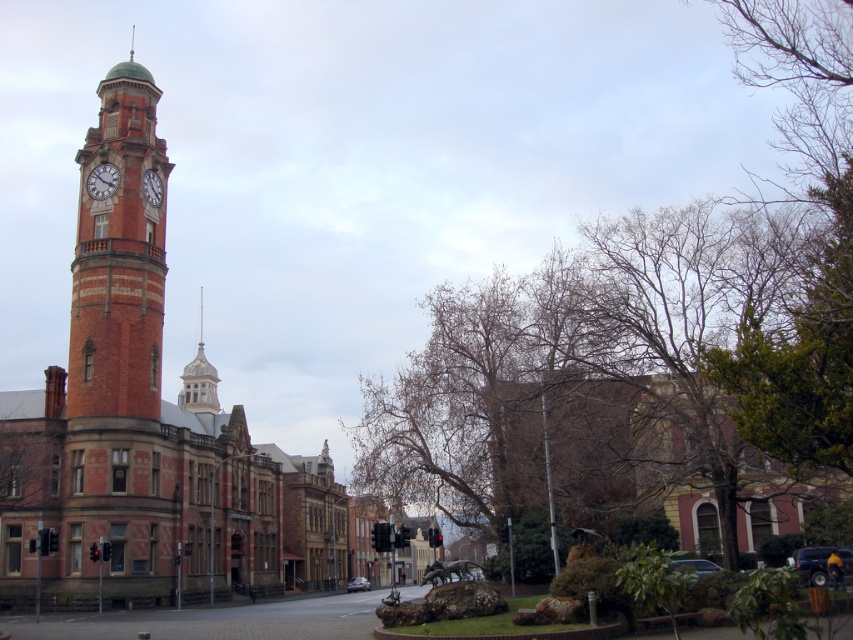
Based on the photo, how far apart are brick clock tower at left and matte brick clock tower at left?

brick clock tower at left and matte brick clock tower at left are 30.52 feet apart from each other.

Can you confirm if brick clock tower at left is thinner than matte brick clock tower at left?

No.

This screenshot has width=853, height=640. What do you see at coordinates (119, 259) in the screenshot?
I see `brick clock tower at left` at bounding box center [119, 259].

Image resolution: width=853 pixels, height=640 pixels. Find the location of `brick clock tower at left`. brick clock tower at left is located at coordinates (119, 259).

Can you confirm if matte brick clock tower at left is positioned below matte brick clock at left?

No.

Does matte brick clock tower at left appear on the left side of matte brick clock at left?

Yes, matte brick clock tower at left is to the left of matte brick clock at left.

Is point (103, 193) less distant than point (149, 168)?

Yes, point (103, 193) is closer to viewer.

Find the location of a particular element. This screenshot has height=640, width=853. matte brick clock tower at left is located at coordinates (102, 180).

Can you confirm if brick clock tower at left is taller than matte brick clock at left?

Indeed, brick clock tower at left has a greater height compared to matte brick clock at left.

How far apart are brick clock tower at left and matte brick clock at left?

They are 21.28 feet apart.

You are a GUI agent. You are given a task and a screenshot of the screen. Output one action in this format:
    pyautogui.click(x=<x>, y=<y>)
    Task: Click on the brick clock tower at left
    The image size is (853, 640).
    Given the screenshot: What is the action you would take?
    pyautogui.click(x=119, y=259)

The image size is (853, 640). Identify the location of brick clock tower at left. (119, 259).